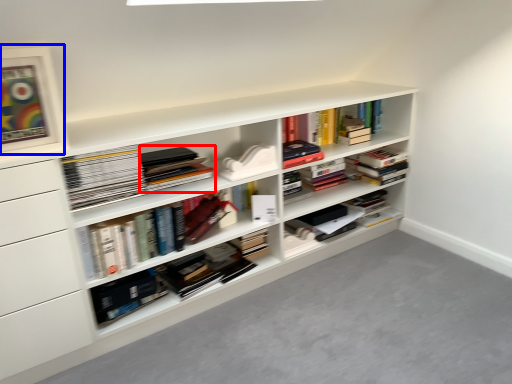
Question: Which of the following is the farthest to the observer, book (highlighted by a red box) or picture frame (highlighted by a blue box)?

Choices:
 (A) book
 (B) picture frame

Answer: (A)